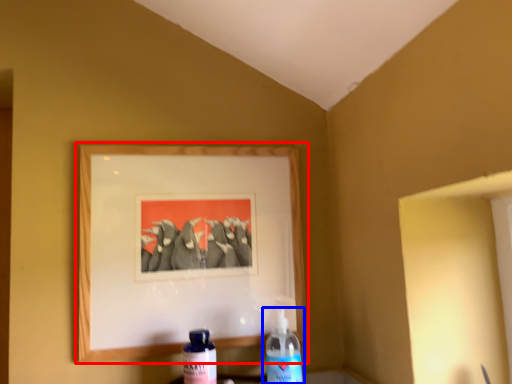
Question: Among these objects, which one is nearest to the camera, picture frame (highlighted by a red box) or bottle (highlighted by a blue box)?

Choices:
 (A) picture frame
 (B) bottle

Answer: (B)